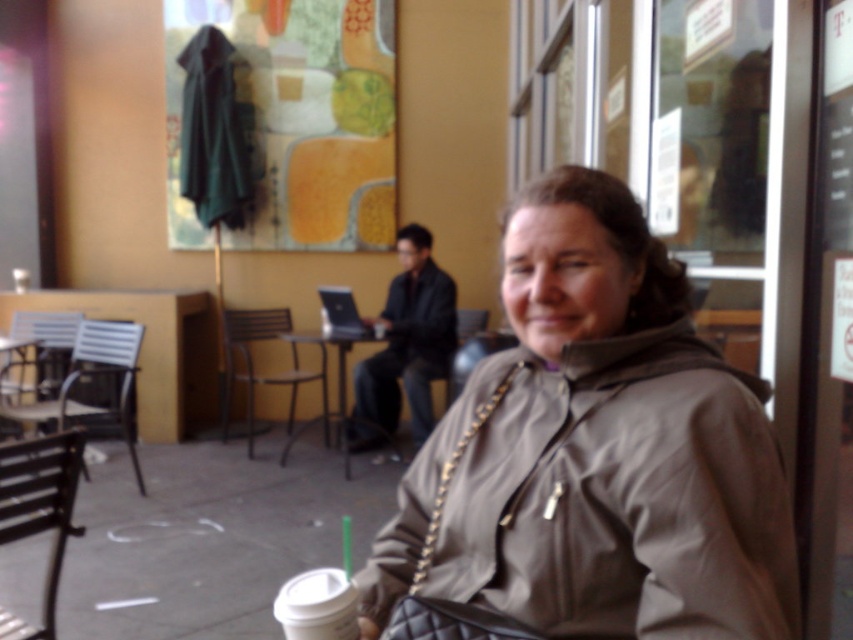
From the picture: You are standing in front of the outdoor cafe scene. There is a point marked at coordinates point (495, 476). If you want to place a small flower pot that is 12 inches in diameter at this point, will it fit without overlapping any existing objects?

The point (495, 476) is 38.95 inches from the viewer. Since the flower pot is 12 inches in diameter, there is enough space at this point to place it without overlapping existing objects.

You are a customer at the outdoor cafe and want to place your new coffee cup on the table. However, you notice the matte gray jacket at center is currently on the metallic silver table at center. Can you place your coffee cup there without moving the jacket?

The matte gray jacket at center is positioned over the metallic silver table at center, so you cannot place your coffee cup there without moving the jacket.

You are a photographer trying to capture a shot of the matte gray jacket at center and the metallic silver table at center. Which object should you focus on first if you want to ensure both are in frame without moving the camera?

The matte gray jacket at center is not as tall as the metallic silver table at center, so focus on the metallic silver table at center first to ensure both are in frame.